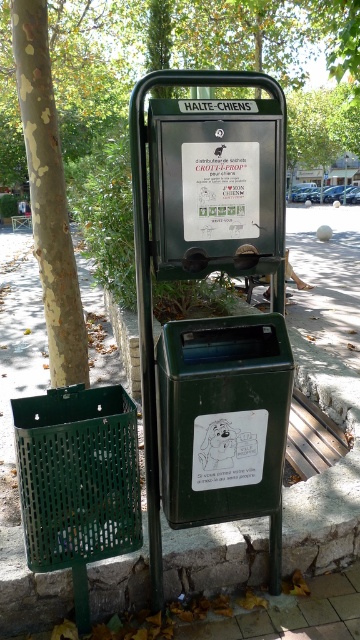
Question: From the image, what is the correct spatial relationship of green plastic basket at left in relation to white paper sign at center?

Choices:
 (A) above
 (B) below

Answer: (B)

Question: From the image, what is the correct spatial relationship of green plastic bus stop at center in relation to speckled bark tree at left?

Choices:
 (A) below
 (B) above

Answer: (A)

Question: Which object is closer to the camera taking this photo?

Choices:
 (A) green plastic basket at left
 (B) green plastic bus stop at center
 (C) white paper sign at center
 (D) speckled bark tree at left

Answer: (A)

Question: Is green matte bin at center smaller than green leafy tree at upper center?

Choices:
 (A) no
 (B) yes

Answer: (B)

Question: Estimate the real-world distances between objects in this image. Which object is farther from the speckled bark tree at left?

Choices:
 (A) green leafy tree at upper center
 (B) green plastic basket at left
 (C) white paper sign at center
 (D) green plastic bus stop at center

Answer: (A)

Question: Which object appears closest to the camera in this image?

Choices:
 (A) green plastic basket at left
 (B) green plastic bus stop at center
 (C) speckled bark tree at left

Answer: (A)